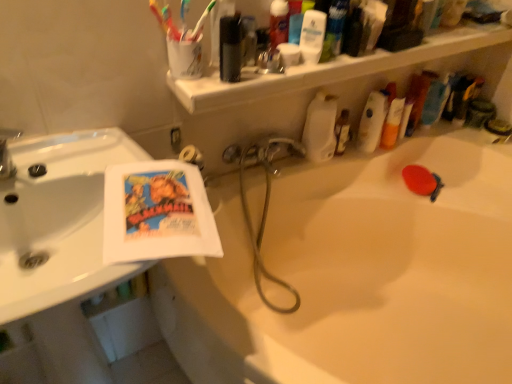
Question: Can you confirm if white plastic shelf at upper center is shorter than metallic silver soap dispenser at upper right, which is counted as the 2th toiletry, starting from the left?

Choices:
 (A) yes
 (B) no

Answer: (A)

Question: Is white plastic shelf at upper center completely or partially outside of metallic silver soap dispenser at upper right, the 1th toiletry from the right?

Choices:
 (A) yes
 (B) no

Answer: (A)

Question: Does white plastic shelf at upper center come in front of metallic silver soap dispenser at upper right, the 1th toiletry from the right?

Choices:
 (A) yes
 (B) no

Answer: (A)

Question: Is white plastic shelf at upper center touching metallic silver soap dispenser at upper right, the 1th toiletry from the right?

Choices:
 (A) no
 (B) yes

Answer: (A)

Question: Does white plastic shelf at upper center turn towards metallic silver soap dispenser at upper right, which is counted as the 2th toiletry, starting from the left?

Choices:
 (A) yes
 (B) no

Answer: (B)

Question: In the image, is metallic silver mouthwash at upper center, the first mouthwash in the left-to-right sequence, positioned in front of or behind black rubber hose at center?

Choices:
 (A) behind
 (B) front

Answer: (B)

Question: Is metallic silver mouthwash at upper center, arranged as the second mouthwash when viewed from the right, bigger or smaller than black rubber hose at center?

Choices:
 (A) big
 (B) small

Answer: (B)

Question: Is metallic silver mouthwash at upper center, the first mouthwash in the left-to-right sequence, taller or shorter than black rubber hose at center?

Choices:
 (A) short
 (B) tall

Answer: (B)

Question: Is metallic silver mouthwash at upper center, arranged as the second mouthwash when viewed from the right, inside or outside of black rubber hose at center?

Choices:
 (A) inside
 (B) outside

Answer: (B)

Question: Is white glossy bathtub at center to the left or to the right of metallic silver mouthwash at upper center, the first mouthwash in the left-to-right sequence, in the image?

Choices:
 (A) left
 (B) right

Answer: (B)

Question: Is white glossy bathtub at center taller or shorter than metallic silver mouthwash at upper center, arranged as the second mouthwash when viewed from the right?

Choices:
 (A) short
 (B) tall

Answer: (B)

Question: Is white glossy bathtub at center spatially inside metallic silver mouthwash at upper center, arranged as the second mouthwash when viewed from the right, or outside of it?

Choices:
 (A) inside
 (B) outside

Answer: (B)

Question: In the image, is white glossy bathtub at center positioned in front of or behind metallic silver mouthwash at upper center, arranged as the second mouthwash when viewed from the right?

Choices:
 (A) front
 (B) behind

Answer: (A)

Question: From a real-world perspective, is white matte bottle at upper center, which is counted as the 1th cleaning product, starting from the left, above or below white glossy mouthwash at upper center, which appears as the first mouthwash when viewed from the right?

Choices:
 (A) below
 (B) above

Answer: (A)

Question: From the image's perspective, is white matte bottle at upper center, which is counted as the 1th cleaning product, starting from the left, positioned above or below white glossy mouthwash at upper center, arranged as the second mouthwash when viewed from the left?

Choices:
 (A) below
 (B) above

Answer: (A)